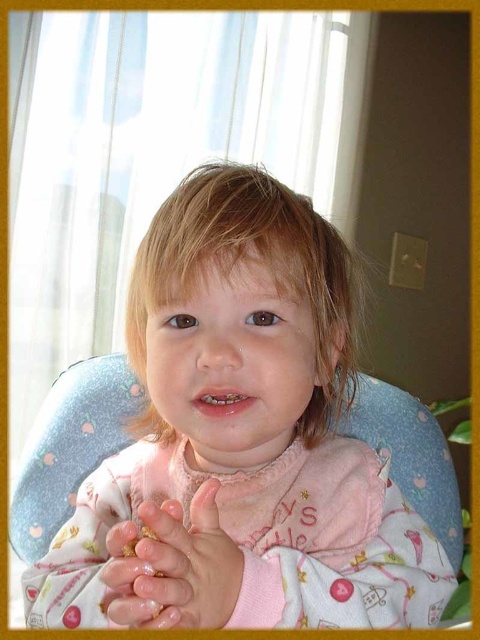
Who is positioned more to the right, pink fabric bib at center or smooth skin hands at center?

From the viewer's perspective, pink fabric bib at center appears more on the right side.

The height and width of the screenshot is (640, 480). Find the location of `pink fabric bib at center`. pink fabric bib at center is located at coordinates (240, 440).